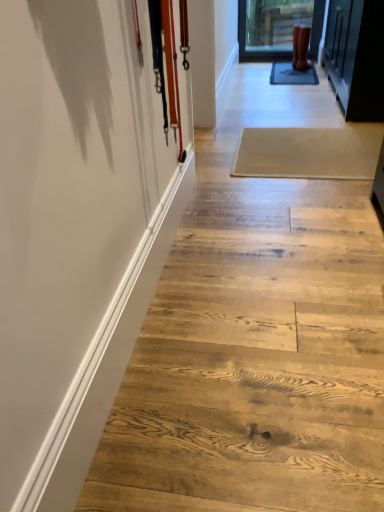
Image resolution: width=384 pixels, height=512 pixels. Describe the element at coordinates (308, 152) in the screenshot. I see `beige wood plank at center` at that location.

The height and width of the screenshot is (512, 384). What do you see at coordinates (76, 230) in the screenshot?
I see `white glossy barn door at left` at bounding box center [76, 230].

This screenshot has height=512, width=384. I want to click on white glossy barn door at left, so click(x=76, y=230).

Where is `beige wood plank at center`? beige wood plank at center is located at coordinates (308, 152).

Is natural wood stairs at center taller or shorter than beige wood plank at center?

natural wood stairs at center is taller than beige wood plank at center.

Between natural wood stairs at center and beige wood plank at center, which one has smaller width?

beige wood plank at center.

From the image's perspective, which one is positioned lower, natural wood stairs at center or beige wood plank at center?

beige wood plank at center is shown below in the image.

Is rubber matte boots at upper right facing towards natural wood stairs at center?

No, rubber matte boots at upper right is not oriented towards natural wood stairs at center.

From a real-world perspective, which object stands above the other?

rubber matte boots at upper right.

Based on the photo, can you tell me how much white glossy barn door at left and beige wood plank at center differ in facing direction?

179 degrees separate the facing orientations of white glossy barn door at left and beige wood plank at center.

This screenshot has width=384, height=512. Find the location of `barn door in front of the beige wood plank at center`. barn door in front of the beige wood plank at center is located at coordinates (76, 230).

Is white glossy barn door at left turned away from beige wood plank at center?

white glossy barn door at left is not turned away from beige wood plank at center.

Between point (82, 3) and point (242, 137), which one is positioned behind?

The point (242, 137) is more distant.

Would you say natural wood stairs at center is inside or outside rubber matte boots at upper right?

natural wood stairs at center exists outside the volume of rubber matte boots at upper right.

Is natural wood stairs at center with rubber matte boots at upper right?

natural wood stairs at center is not next to rubber matte boots at upper right, and they're not touching.

Is natural wood stairs at center turned away from rubber matte boots at upper right?

No, natural wood stairs at center's orientation is not away from rubber matte boots at upper right.

Which of these two, natural wood stairs at center or rubber matte boots at upper right, is bigger?

natural wood stairs at center is bigger.

How different are the orientations of beige wood plank at center and white glossy barn door at left in degrees?

There is a 179-degree angle between the facing directions of beige wood plank at center and white glossy barn door at left.

Consider the image. Measure the distance between beige wood plank at center and white glossy barn door at left.

beige wood plank at center and white glossy barn door at left are 3.53 feet apart from each other.

From the picture: Do you think beige wood plank at center is within white glossy barn door at left, or outside of it?

beige wood plank at center is located beyond the bounds of white glossy barn door at left.

Identify the location of barn door located on the left of beige wood plank at center. This screenshot has width=384, height=512. (76, 230).

Is the position of rubber matte boots at upper right more distant than that of white glossy barn door at left?

Yes, rubber matte boots at upper right is further from the viewer.

Considering the relative sizes of rubber matte boots at upper right and white glossy barn door at left in the image provided, is rubber matte boots at upper right bigger than white glossy barn door at left?

Incorrect, rubber matte boots at upper right is not larger than white glossy barn door at left.

I want to click on footwear positioned vertically above the white glossy barn door at left (from a real-world perspective), so click(x=300, y=48).

Which is correct: rubber matte boots at upper right is inside white glossy barn door at left, or outside of it?

rubber matte boots at upper right is not enclosed by white glossy barn door at left.

Who is smaller, beige wood plank at center or rubber matte boots at upper right?

rubber matte boots at upper right.

Is beige wood plank at center further to camera compared to rubber matte boots at upper right?

No, beige wood plank at center is in front of rubber matte boots at upper right.

Is rubber matte boots at upper right located within beige wood plank at center?

No, rubber matte boots at upper right is not a part of beige wood plank at center.

Looking at this image, between beige wood plank at center and rubber matte boots at upper right, which one has smaller width?

Thinner between the two is rubber matte boots at upper right.

Locate an element on the screen. plank behind the natural wood stairs at center is located at coordinates (308, 152).

Where is `footwear located above the natural wood stairs at center (from the image's perspective)`? footwear located above the natural wood stairs at center (from the image's perspective) is located at coordinates (300, 48).

Considering their positions, is natural wood stairs at center positioned closer to white glossy barn door at left than beige wood plank at center?

The object closer to white glossy barn door at left is natural wood stairs at center.

When comparing their distances from rubber matte boots at upper right, does natural wood stairs at center or white glossy barn door at left seem further?

Based on the image, white glossy barn door at left appears to be further to rubber matte boots at upper right.

Which object lies nearer to the anchor point natural wood stairs at center, white glossy barn door at left or rubber matte boots at upper right?

white glossy barn door at left is closer to natural wood stairs at center.

When comparing their distances from rubber matte boots at upper right, does beige wood plank at center or natural wood stairs at center seem further?

→ natural wood stairs at center lies further to rubber matte boots at upper right than the other object.

Looking at the image, which one is located closer to beige wood plank at center, natural wood stairs at center or white glossy barn door at left?

natural wood stairs at center is closer to beige wood plank at center.

Based on their spatial positions, is rubber matte boots at upper right or beige wood plank at center further from white glossy barn door at left?

rubber matte boots at upper right lies further to white glossy barn door at left than the other object.

Looking at this image, from the image, which object appears to be nearer to rubber matte boots at upper right, white glossy barn door at left or natural wood stairs at center?

The object closer to rubber matte boots at upper right is natural wood stairs at center.

From the image, which object appears to be farther from natural wood stairs at center, white glossy barn door at left or beige wood plank at center?

beige wood plank at center lies further to natural wood stairs at center than the other object.

Where is `plank between white glossy barn door at left and rubber matte boots at upper right from front to back`? Image resolution: width=384 pixels, height=512 pixels. plank between white glossy barn door at left and rubber matte boots at upper right from front to back is located at coordinates (308, 152).

You are a GUI agent. You are given a task and a screenshot of the screen. Output one action in this format:
    pyautogui.click(x=<x>, y=<y>)
    Task: Click on the barn door between natural wood stairs at center and beige wood plank at center from front to back
    
    Given the screenshot: What is the action you would take?
    tap(76, 230)

You are a GUI agent. You are given a task and a screenshot of the screen. Output one action in this format:
    pyautogui.click(x=<x>, y=<y>)
    Task: Click on the plank positioned between natural wood stairs at center and rubber matte boots at upper right from near to far
    This screenshot has height=512, width=384.
    Given the screenshot: What is the action you would take?
    [308, 152]

The height and width of the screenshot is (512, 384). I want to click on barn door positioned between natural wood stairs at center and rubber matte boots at upper right from near to far, so click(x=76, y=230).